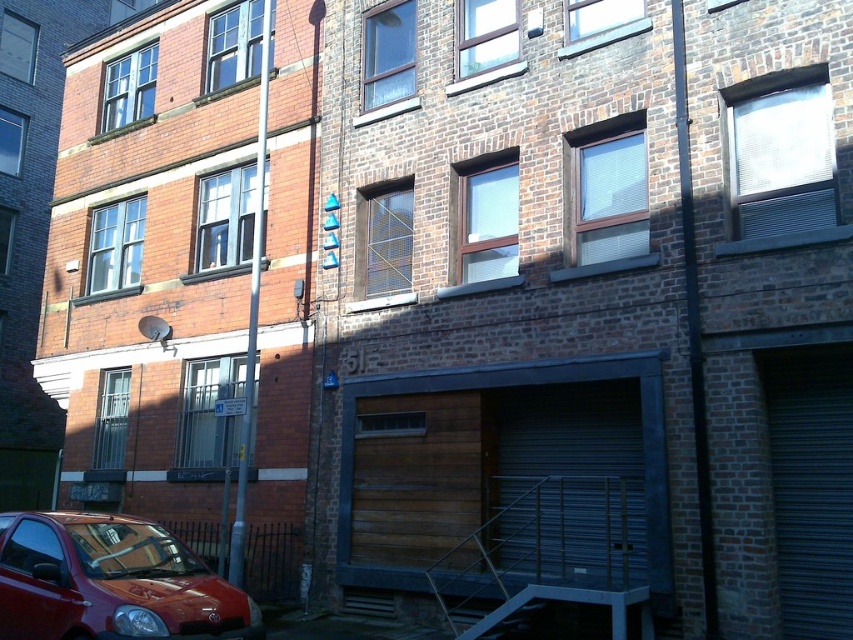
You are a delivery person trying to access the garage area of the building. You need to choose between the metallic gray garage door at lower center and the dark gray metallic garage door at lower right. Which door should you approach if you need to deliver a large package that requires more space?

You should approach the metallic gray garage door at lower center because it has a larger size compared to the dark gray metallic garage door at lower right, providing more space for the large package.

You are standing at the entrance of the building and want to locate the dark gray metallic garage door at lower right. According to the coordinates provided, where exactly would you find it?

The dark gray metallic garage door at lower right is located at point (811, 486).